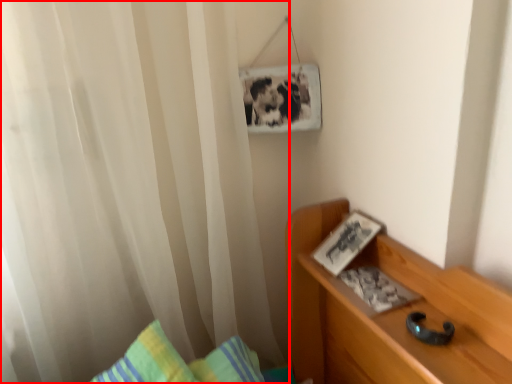
Question: From the image's perspective, where is curtain (annotated by the red box) located in relation to book in the image?

Choices:
 (A) above
 (B) below

Answer: (A)